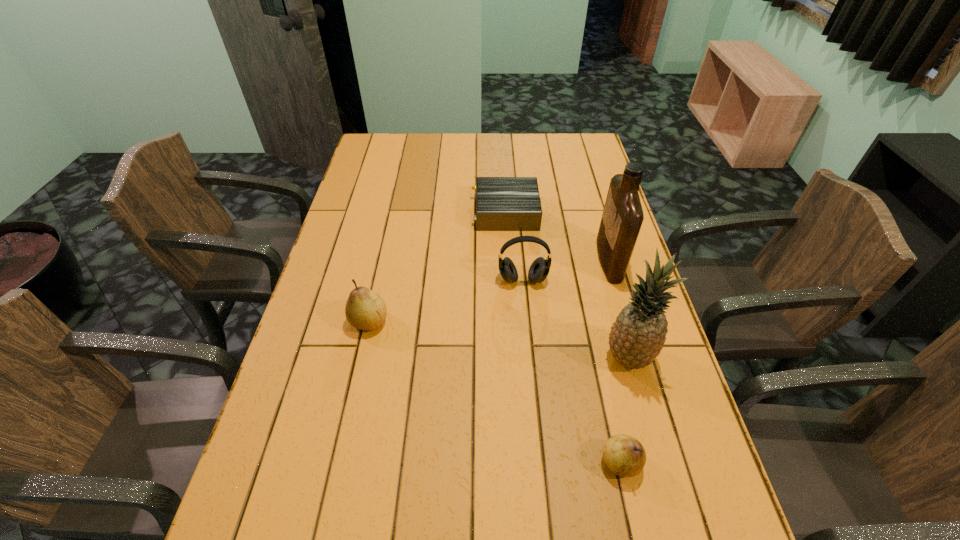
Find the location of a particular element. The width and height of the screenshot is (960, 540). the fourth farthest object is located at coordinates (365, 309).

The width and height of the screenshot is (960, 540). Find the location of `the farther pear`. the farther pear is located at coordinates (365, 309).

I want to click on the shorter pear, so click(x=625, y=456).

Locate an element on the screen. This screenshot has height=540, width=960. the nearer pear is located at coordinates (625, 456).

The height and width of the screenshot is (540, 960). I want to click on liquor, so click(x=622, y=217).

Find the location of a particular element. router is located at coordinates (502, 203).

Locate an element on the screen. the shortest object is located at coordinates (502, 203).

Where is `pineapple`? This screenshot has width=960, height=540. pineapple is located at coordinates (637, 337).

In order to click on headset in this screenshot , I will do `click(539, 269)`.

Locate an element on the screen. The image size is (960, 540). free region located 0.380m on the front of the taller pear is located at coordinates [331, 492].